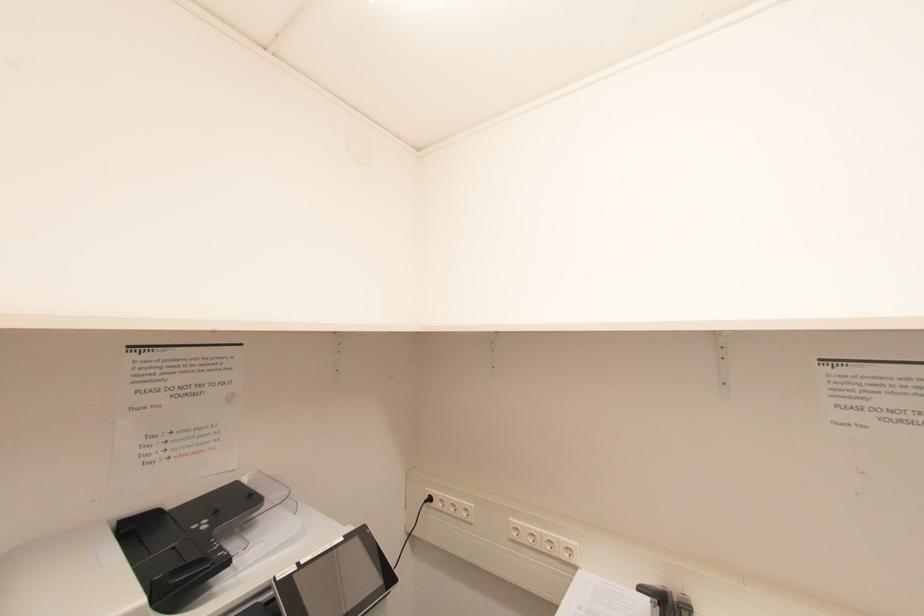
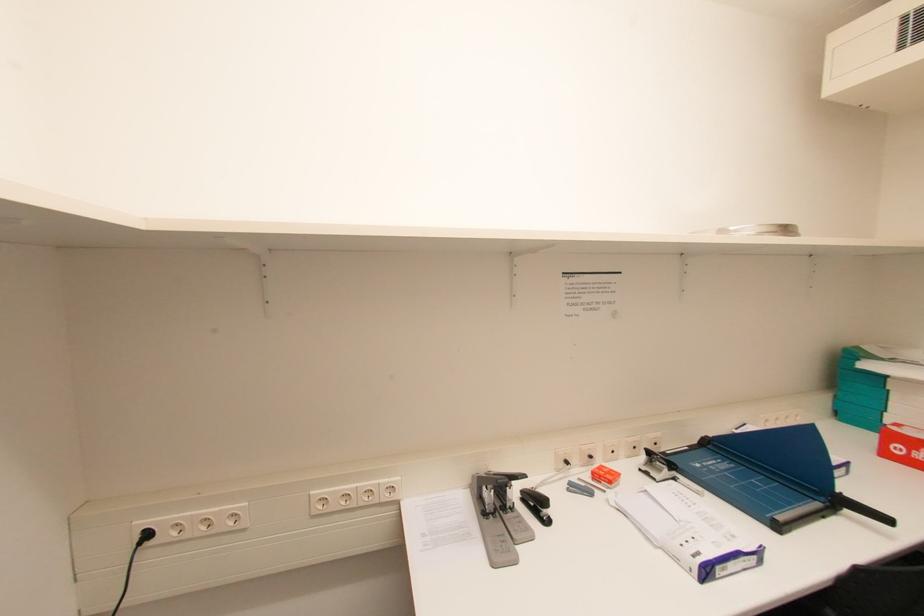
Question: The first image is from the beginning of the video and the second image is from the end. How did the camera likely rotate when shooting the video?

Choices:
 (A) Left
 (B) Right
 (C) Up
 (D) Down

Answer: (B)